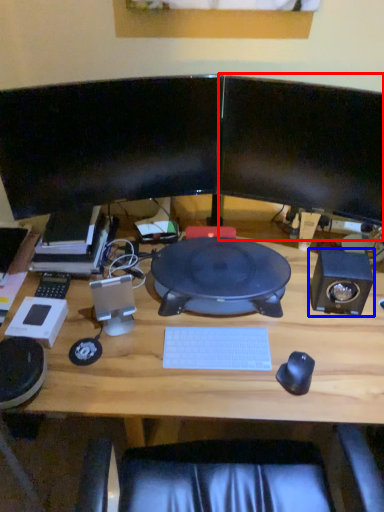
Question: Which object is closer to the camera taking this photo, computer monitor (highlighted by a red box) or speaker (highlighted by a blue box)?

Choices:
 (A) computer monitor
 (B) speaker

Answer: (A)